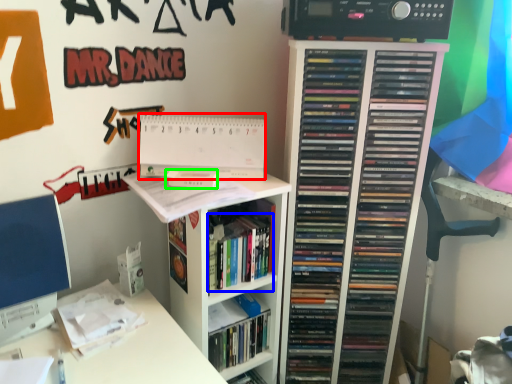
Question: Which object is positioned closest to paperback book (highlighted by a red box)? Select from book (highlighted by a blue box) and paperback book (highlighted by a green box).

Choices:
 (A) book
 (B) paperback book

Answer: (B)